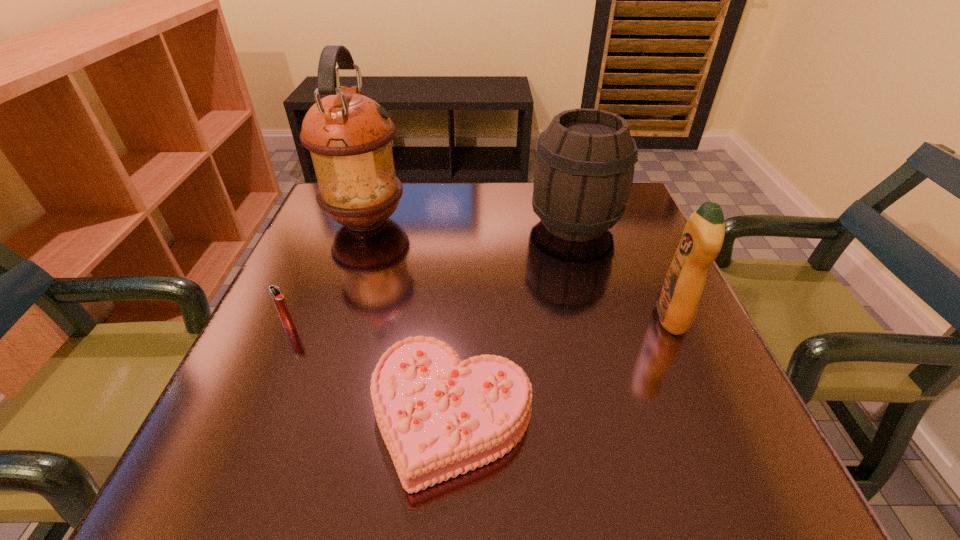
Identify the location of oil lamp. (349, 135).

In order to click on wine bucket in this screenshot , I will do `click(584, 169)`.

Find the location of `detergent`. detergent is located at coordinates (702, 239).

What are the coordinates of `igniter` in the screenshot? It's located at (279, 301).

Locate an element on the screen. The width and height of the screenshot is (960, 540). the third object from right to left is located at coordinates (439, 417).

Where is `the nearest object`? The image size is (960, 540). the nearest object is located at coordinates (x=439, y=417).

Locate an element on the screen. The width and height of the screenshot is (960, 540). free space located on the front of the tallest object is located at coordinates (319, 357).

Locate an element on the screen. free space located on the left of the wine bucket is located at coordinates (438, 223).

Image resolution: width=960 pixels, height=540 pixels. In order to click on vacant area situated 0.320m on the label of the detergent in this screenshot , I will do tap(486, 318).

This screenshot has width=960, height=540. Identify the location of free space located on the label of the detergent. click(501, 318).